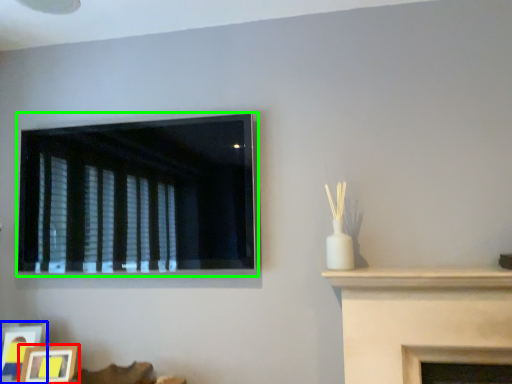
Question: Which is farther away from picture frame (highlighted by a red box)? picture frame (highlighted by a blue box) or window (highlighted by a green box)?

Choices:
 (A) picture frame
 (B) window

Answer: (B)